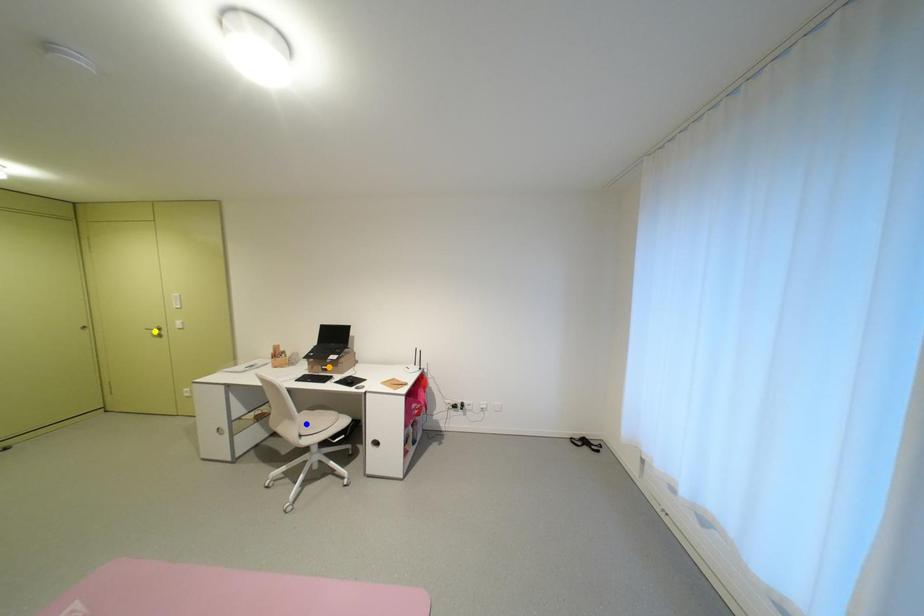
Order these from farthest to nearest:
yellow point | blue point | orange point

1. yellow point
2. orange point
3. blue point